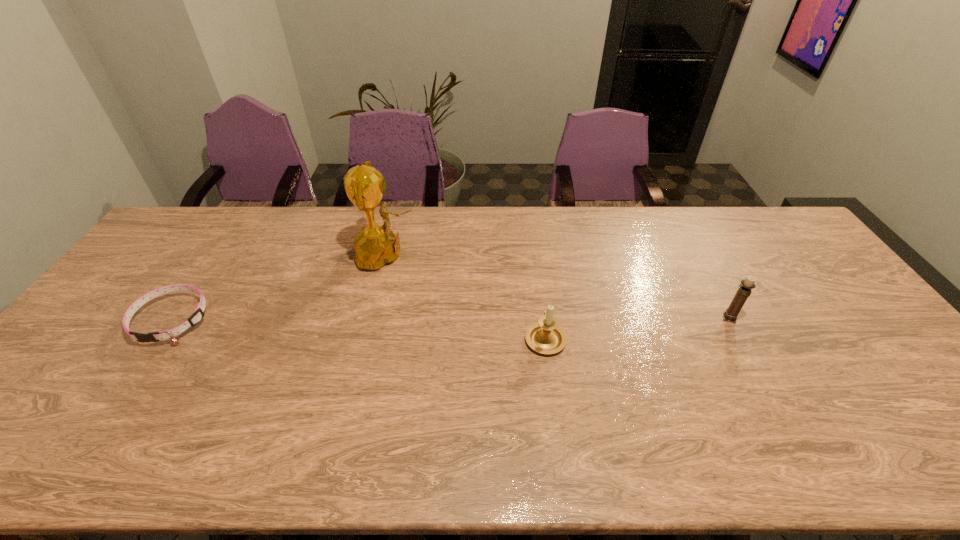
Find the location of a particular element. free space located with a handle on the side of the shorter candle holder is located at coordinates (533, 249).

Locate an element on the screen. Image resolution: width=960 pixels, height=540 pixels. vacant space located with a handle on the side of the shorter candle holder is located at coordinates (x=538, y=283).

What are the coordinates of `vacant point located with the buckle on the leftmost object` in the screenshot? It's located at (115, 405).

This screenshot has height=540, width=960. What are the coordinates of `object that is at the far edge` in the screenshot? It's located at (376, 245).

At what (x,y) coordinates should I click in order to perform the action: click on object that is positioned at the left edge. Please return your answer as a coordinate pair (x, y). This screenshot has height=540, width=960. Looking at the image, I should click on (197, 316).

I want to click on vacant region at the far edge of the desktop, so click(x=622, y=206).

Locate an element on the screen. This screenshot has height=540, width=960. free region at the near edge of the desktop is located at coordinates (179, 438).

Identify the location of vacant region at the left edge of the desktop. The height and width of the screenshot is (540, 960). (152, 304).

In the image, there is a desktop. Where is `free region at the right edge`? The height and width of the screenshot is (540, 960). free region at the right edge is located at coordinates (810, 304).

Where is `free space at the far right corner`? free space at the far right corner is located at coordinates (797, 237).